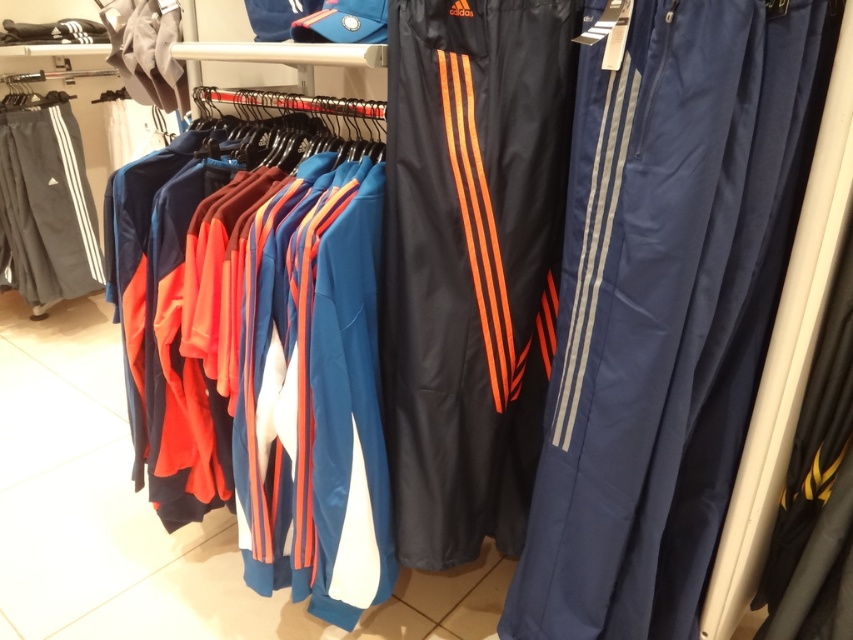
Question: Does navy blue track pants at center have a greater width compared to black synthetic track pants at center?

Choices:
 (A) no
 (B) yes

Answer: (B)

Question: Estimate the real-world distances between objects in this image. Which object is farther from the navy blue track pants at center?

Choices:
 (A) black synthetic track pants at center
 (B) gray cotton track pants at left
 (C) orange and blue tracksuit at center
 (D) matte gray hoodie at upper left

Answer: (B)

Question: Can you confirm if black synthetic track pants at center is smaller than matte gray hoodie at upper left?

Choices:
 (A) no
 (B) yes

Answer: (A)

Question: Which object is closer to the camera taking this photo?

Choices:
 (A) orange and blue tracksuit at center
 (B) black synthetic track pants at center
 (C) matte gray hoodie at upper left
 (D) navy blue track pants at center

Answer: (D)

Question: Estimate the real-world distances between objects in this image. Which object is closer to the matte gray hoodie at upper left?

Choices:
 (A) orange and blue tracksuit at center
 (B) navy blue track pants at center

Answer: (A)

Question: Is orange and blue tracksuit at center below black synthetic track pants at center?

Choices:
 (A) no
 (B) yes

Answer: (B)